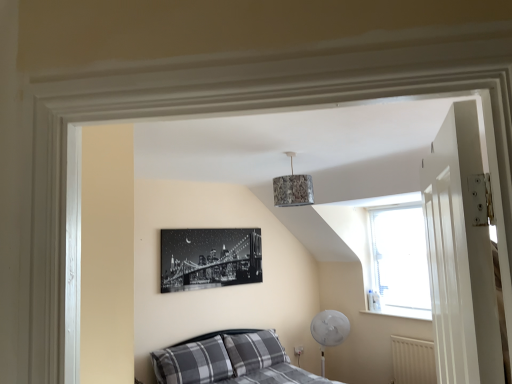
Where is `free point above white textured radiator at lower right (from a real-world perspective)`? free point above white textured radiator at lower right (from a real-world perspective) is located at coordinates tap(409, 336).